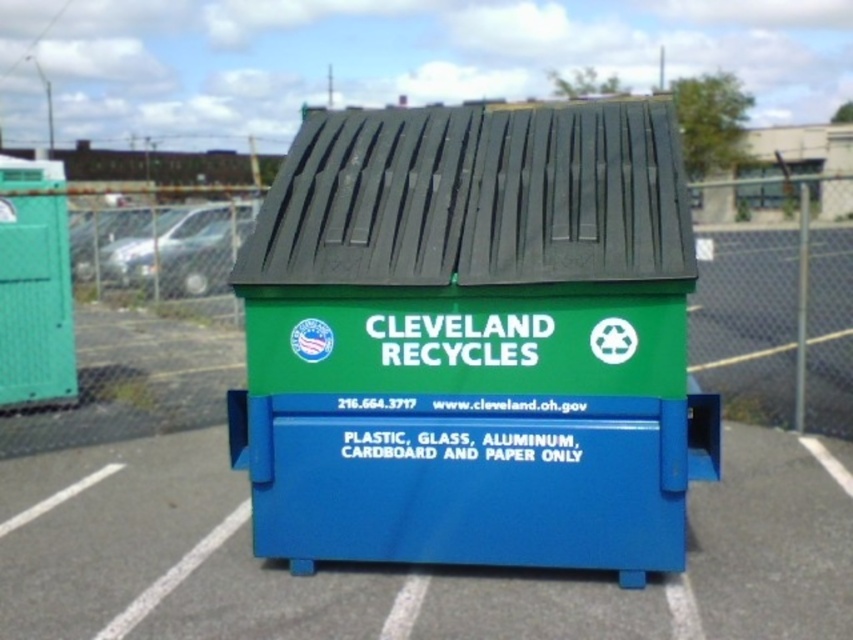
I want to click on green plastic/recycled material recycling bin at center, so click(473, 340).